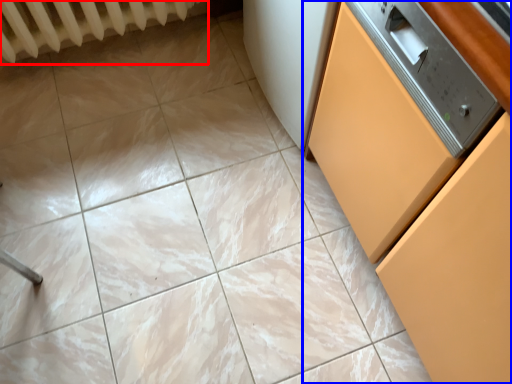
Question: Among these objects, which one is nearest to the camera, radiator (highlighted by a red box) or cabinetry (highlighted by a blue box)?

Choices:
 (A) radiator
 (B) cabinetry

Answer: (B)